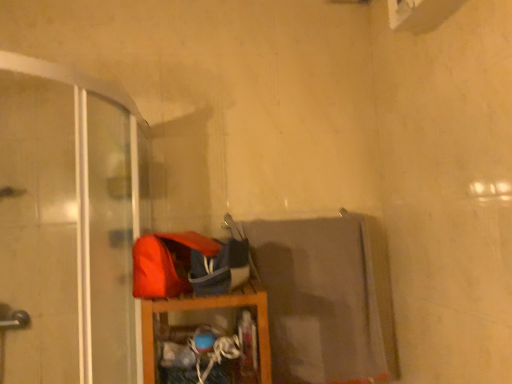
Question: Considering the positions of transparent plastic screen door at left and wooden shelf at lower center in the image, is transparent plastic screen door at left bigger or smaller than wooden shelf at lower center?

Choices:
 (A) small
 (B) big

Answer: (B)

Question: Would you say transparent plastic screen door at left is to the left or to the right of wooden shelf at lower center in the picture?

Choices:
 (A) right
 (B) left

Answer: (B)

Question: Is transparent plastic screen door at left inside the boundaries of wooden shelf at lower center, or outside?

Choices:
 (A) inside
 (B) outside

Answer: (B)

Question: Based on their sizes in the image, would you say wooden shelf at lower center is bigger or smaller than transparent plastic screen door at left?

Choices:
 (A) big
 (B) small

Answer: (B)

Question: In the image, is wooden shelf at lower center on the left side or the right side of transparent plastic screen door at left?

Choices:
 (A) left
 (B) right

Answer: (B)

Question: In the image, is wooden shelf at lower center positioned in front of or behind transparent plastic screen door at left?

Choices:
 (A) front
 (B) behind

Answer: (B)

Question: From a real-world perspective, relative to transparent plastic screen door at left, is wooden shelf at lower center vertically above or below?

Choices:
 (A) above
 (B) below

Answer: (B)